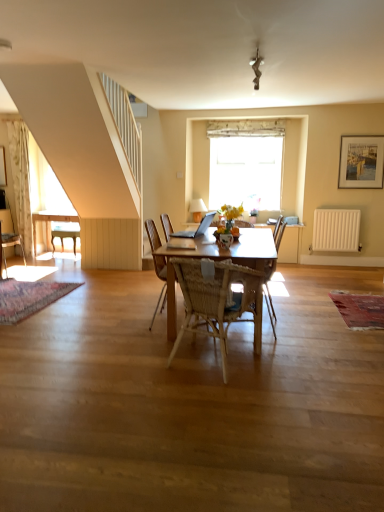
Find the location of a particular element. silver metallic laptop at center is located at coordinates (197, 228).

Image resolution: width=384 pixels, height=512 pixels. What do you see at coordinates (21, 180) in the screenshot? I see `white floral fabric curtain at left` at bounding box center [21, 180].

The image size is (384, 512). Identify the location of white fabric curtain at upper center. (245, 163).

I want to click on wooden chair at left, which is the 2th chair from right to left, so pos(65,234).

The width and height of the screenshot is (384, 512). I want to click on silver metallic laptop at center, so click(x=197, y=228).

Image resolution: width=384 pixels, height=512 pixels. In order to click on curtain above the wooden chair at left, the 2th chair in the left-to-right sequence (from a real-world perspective) in this screenshot , I will do `click(21, 180)`.

Is white floral fabric curtain at left positioned before wooden chair at left, the 1th chair positioned from the back?

Yes, it is in front of wooden chair at left, the 1th chair positioned from the back.

How many degrees apart are the facing directions of white floral fabric curtain at left and wooden chair at left, the 1th chair positioned from the back?

1.22 degrees separate the facing orientations of white floral fabric curtain at left and wooden chair at left, the 1th chair positioned from the back.

From the image's perspective, is white floral fabric curtain at left above or below wooden chair at left, which is the 2th chair from right to left?

From the image's perspective, white floral fabric curtain at left appears above wooden chair at left, which is the 2th chair from right to left.

Is the depth of white fabric curtain at upper center greater than that of translucent glass vase at center?

Yes, white fabric curtain at upper center is further from the viewer.

Is white fabric curtain at upper center beside translucent glass vase at center?

No, white fabric curtain at upper center is not beside translucent glass vase at center.

Which is correct: white fabric curtain at upper center is inside translucent glass vase at center, or outside of it?

white fabric curtain at upper center is not enclosed by translucent glass vase at center.

Considering the positions of points (337, 242) and (71, 223), is point (337, 242) farther from camera compared to point (71, 223)?

No.

Is white matte radiator at right looking in the opposite direction of wooden chair at left, the 1th chair positioned from the back?

No, white matte radiator at right is not facing the opposite direction of wooden chair at left, the 1th chair positioned from the back.

Considering the relative positions of white matte radiator at right and wooden chair at left, the 2th chair in the left-to-right sequence, in the image provided, is white matte radiator at right in front of wooden chair at left, the 2th chair in the left-to-right sequence,?

That is True.

Can you confirm if white matte radiator at right is taller than wooden chair at left, which ranks as the third chair in front-to-back order?

Yes.

Is point (363, 188) behind point (40, 221)?

Yes.

From a real-world perspective, between wooden framed painting at upper right and wooden desk at left, who is vertically lower?

In real-world perspective, wooden desk at left is lower.

From the image's perspective, is wooden framed painting at upper right located beneath wooden desk at left?

Incorrect, from the image's perspective, wooden framed painting at upper right is higher than wooden desk at left.

Is the depth of wooden framed painting at upper right greater than that of wooden desk at left?

No, wooden framed painting at upper right is closer to the viewer.

Does woven wood armchair at center contain wooden desk at left?

No, woven wood armchair at center does not contain wooden desk at left.

Considering the points (265, 276) and (35, 221), which point is behind, point (265, 276) or point (35, 221)?

The point (35, 221) is farther from the camera.

From the image's perspective, would you say woven wood armchair at center is positioned over wooden desk at left?

No, from the image's perspective, woven wood armchair at center is not over wooden desk at left.

Based on the photo, from the image's perspective, does wooden desk at left appear lower than woven wood armchair at center?

Answer: Incorrect, from the image's perspective, wooden desk at left is higher than woven wood armchair at center.

From a real-world perspective, is wooden desk at left under woven wood armchair at center?

Correct, in the physical world, wooden desk at left is lower than woven wood armchair at center.

Can you confirm if wooden desk at left is bigger than woven wood armchair at center?

Correct, wooden desk at left is larger in size than woven wood armchair at center.

Which is less distant, (45,222) or (272,326)?

Point (45,222) is positioned farther from the camera compared to point (272,326).

Considering the relative sizes of silver metallic laptop at center and woven wood chair at center, the first chair from the right, in the image provided, is silver metallic laptop at center thinner than woven wood chair at center, the first chair from the right,?

Yes.

Is silver metallic laptop at center not near woven wood chair at center, the first chair from the right?

Yes.

Considering the relative positions of silver metallic laptop at center and woven wood chair at center, the first chair from the right, in the image provided, is silver metallic laptop at center to the right of woven wood chair at center, the first chair from the right, from the viewer's perspective?

No, silver metallic laptop at center is not to the right of woven wood chair at center, the first chair from the right.

This screenshot has height=512, width=384. I want to click on curtain above the wooden chair at left, the 1th chair positioned from the back (from the image's perspective), so click(21, 180).

The height and width of the screenshot is (512, 384). In order to click on window located on the right of translucent glass vase at center in this screenshot , I will do `click(245, 163)`.

Considering their positions, is wooden chair at left, the first chair positioned from the left, positioned further to white floral fabric curtain at left than wooden desk at left?

Based on the image, wooden chair at left, the first chair positioned from the left, appears to be further to white floral fabric curtain at left.

In the scene shown: When comparing their distances from silver metallic laptop at center, does woven wood armchair at center or translucent glass vase at center seem closer?

translucent glass vase at center is closer to silver metallic laptop at center.

Looking at the image, which one is located closer to white fabric curtain at upper center, silver metallic laptop at center or wooden chair at left, which is the 2th chair from right to left?

silver metallic laptop at center lies closer to white fabric curtain at upper center than the other object.

Which object lies nearer to the anchor point woven wood armchair at center, translucent glass vase at center or white floral fabric curtain at left?

Based on the image, translucent glass vase at center appears to be nearer to woven wood armchair at center.

From the image, which object appears to be nearer to white matte radiator at right, wooden desk at left or silver metallic laptop at center?

silver metallic laptop at center is closer to white matte radiator at right.

In the scene shown: Based on their spatial positions, is white floral fabric curtain at left or wooden desk at left further from white fabric curtain at upper center?

white floral fabric curtain at left is positioned further to the anchor white fabric curtain at upper center.

Estimate the real-world distances between objects in this image. Which object is further from wooden framed painting at upper right, wooden chair at left, the 2th chair in the left-to-right sequence, or white floral fabric curtain at left?

white floral fabric curtain at left lies further to wooden framed painting at upper right than the other object.

From the image, which object appears to be farther from wooden desk at left, wooden chair at left, the first chair positioned from the left, or silver metallic laptop at center?

silver metallic laptop at center is positioned further to the anchor wooden desk at left.

Image resolution: width=384 pixels, height=512 pixels. In order to click on picture frame between woven wood armchair at center and white fabric curtain at upper center from front to back in this screenshot , I will do `click(361, 162)`.

The height and width of the screenshot is (512, 384). I want to click on laptop between woven wood armchair at center and white fabric curtain at upper center from front to back, so click(197, 228).

In order to click on radiator located between silver metallic laptop at center and white fabric curtain at upper center in the depth direction in this screenshot , I will do `click(336, 230)`.

Locate an element on the screen. This screenshot has width=384, height=512. vase positioned between woven wood chair at center, which ranks as the first chair in front-to-back order, and silver metallic laptop at center from near to far is located at coordinates coord(225,240).